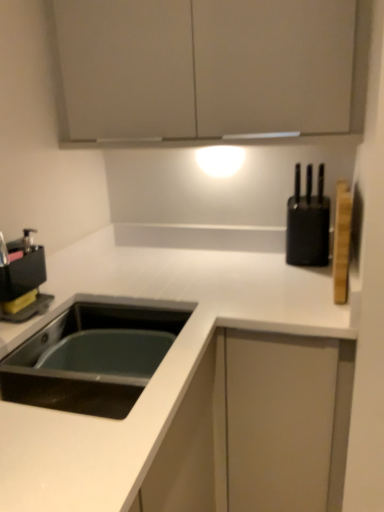
Question: Does matte white cabinet at upper center come behind black plastic coffee machine at left?

Choices:
 (A) no
 (B) yes

Answer: (A)

Question: Considering the relative sizes of matte white cabinet at upper center and black plastic coffee machine at left in the image provided, is matte white cabinet at upper center taller than black plastic coffee machine at left?

Choices:
 (A) no
 (B) yes

Answer: (B)

Question: Considering the relative sizes of matte white cabinet at upper center and black plastic coffee machine at left in the image provided, is matte white cabinet at upper center bigger than black plastic coffee machine at left?

Choices:
 (A) no
 (B) yes

Answer: (B)

Question: Is matte white cabinet at upper center oriented towards black plastic coffee machine at left?

Choices:
 (A) no
 (B) yes

Answer: (A)

Question: Is matte white cabinet at upper center wider than black plastic coffee machine at left?

Choices:
 (A) no
 (B) yes

Answer: (B)

Question: Which is correct: white matte countertop at lower left is inside black plastic coffee machine at left, or outside of it?

Choices:
 (A) inside
 (B) outside

Answer: (B)

Question: Considering the positions of white matte countertop at lower left and black plastic coffee machine at left in the image, is white matte countertop at lower left bigger or smaller than black plastic coffee machine at left?

Choices:
 (A) big
 (B) small

Answer: (A)

Question: Based on their positions, is white matte countertop at lower left located to the left or right of black plastic coffee machine at left?

Choices:
 (A) left
 (B) right

Answer: (B)

Question: From the image's perspective, is white matte countertop at lower left positioned above or below black plastic coffee machine at left?

Choices:
 (A) below
 (B) above

Answer: (A)

Question: From the image's perspective, relative to black matte knife block at right, is white matte countertop at lower left above or below?

Choices:
 (A) below
 (B) above

Answer: (A)

Question: Considering the positions of white matte countertop at lower left and black matte knife block at right in the image, is white matte countertop at lower left wider or thinner than black matte knife block at right?

Choices:
 (A) thin
 (B) wide

Answer: (B)

Question: In the image, is white matte countertop at lower left positioned in front of or behind black matte knife block at right?

Choices:
 (A) front
 (B) behind

Answer: (A)

Question: From a real-world perspective, is white matte countertop at lower left physically located above or below black matte knife block at right?

Choices:
 (A) above
 (B) below

Answer: (B)

Question: Is black plastic coffee machine at left wider or thinner than matte white cabinet at upper center?

Choices:
 (A) thin
 (B) wide

Answer: (A)

Question: Does point (6, 315) appear closer or farther from the camera than point (296, 54)?

Choices:
 (A) closer
 (B) farther

Answer: (A)